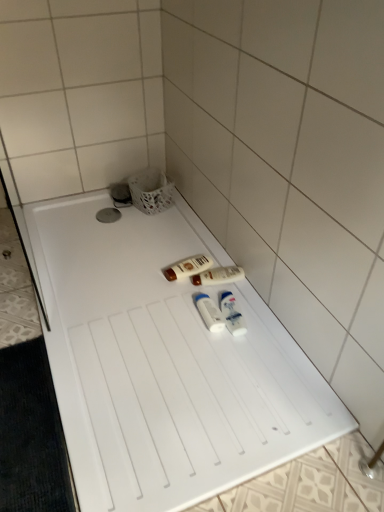
You are a GUI agent. You are given a task and a screenshot of the screen. Output one action in this format:
    pyautogui.click(x=<x>, y=<y>)
    Task: Click on the vacant space behind matte brown lotion at center, which is counted as the 4th toiletry, starting from the front
    This screenshot has height=512, width=384.
    Given the screenshot: What is the action you would take?
    pyautogui.click(x=182, y=247)